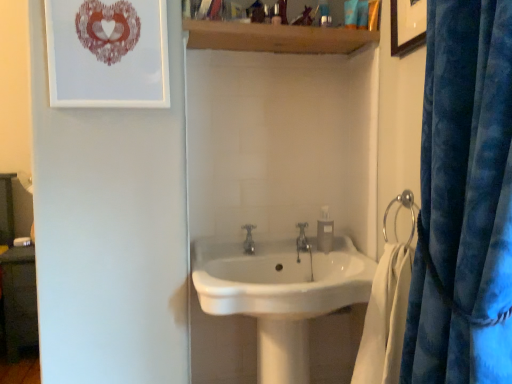
Question: Is matte paper picture frame at upper left, the 1th picture frame positioned from the left, in front of or behind white glossy sink at center in the image?

Choices:
 (A) behind
 (B) front

Answer: (A)

Question: Based on their sizes in the image, would you say matte paper picture frame at upper left, the 1th picture frame positioned from the left, is bigger or smaller than white glossy sink at center?

Choices:
 (A) big
 (B) small

Answer: (B)

Question: Which of these objects is positioned closest to the matte paper picture frame at upper left, acting as the 2th picture frame starting from the right?

Choices:
 (A) silver metallic tap at center, positioned as the first tap in right-to-left order
 (B) white glossy sink at center
 (C) velvet blue curtain at right
 (D) satin nickel faucet at center, which appears as the second tap when viewed from the right
 (E) wooden picture frame at upper right, which ranks as the 1th picture frame in right-to-left order

Answer: (B)

Question: Estimate the real-world distances between objects in this image. Which object is farther from the white glossy sink at center?

Choices:
 (A) wooden shelf at upper center
 (B) silver metallic towel ring at right
 (C) velvet blue curtain at right
 (D) clear plastic soap dispenser at center
 (E) silver metallic tap at center, positioned as the first tap in right-to-left order

Answer: (A)